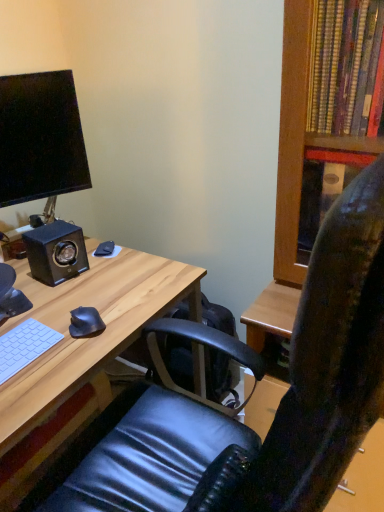
Question: From the image's perspective, is matte black monitor at upper left located above black matte mouse at lower left, which is the first mouse in back-to-front order?

Choices:
 (A) yes
 (B) no

Answer: (A)

Question: Is matte black monitor at upper left to the left of black matte mouse at lower left, the second mouse when ordered from bottom to top, from the viewer's perspective?

Choices:
 (A) yes
 (B) no

Answer: (A)

Question: Does matte black monitor at upper left have a greater height compared to black matte mouse at lower left, which is the first mouse in back-to-front order?

Choices:
 (A) yes
 (B) no

Answer: (A)

Question: Are matte black monitor at upper left and black matte mouse at lower left, the 1th mouse when ordered from top to bottom, beside each other?

Choices:
 (A) yes
 (B) no

Answer: (B)

Question: Can black matte mouse at lower left, which is counted as the 2th mouse, starting from the front, be found inside matte black monitor at upper left?

Choices:
 (A) no
 (B) yes

Answer: (A)

Question: From a real-world perspective, is matte black monitor at upper left physically above black matte mouse at lower left, which is counted as the 2th mouse, starting from the front?

Choices:
 (A) no
 (B) yes

Answer: (B)

Question: Can you confirm if matte black monitor at upper left is shorter than black leather chair at center?

Choices:
 (A) yes
 (B) no

Answer: (A)

Question: Can you confirm if matte black monitor at upper left is wider than black leather chair at center?

Choices:
 (A) yes
 (B) no

Answer: (B)

Question: Is matte black monitor at upper left placed right next to black leather chair at center?

Choices:
 (A) no
 (B) yes

Answer: (A)

Question: From a real-world perspective, is matte black monitor at upper left positioned under black leather chair at center based on gravity?

Choices:
 (A) yes
 (B) no

Answer: (B)

Question: Is matte black monitor at upper left facing away from black leather chair at center?

Choices:
 (A) no
 (B) yes

Answer: (A)

Question: Is matte black monitor at upper left to the right of black leather chair at center from the viewer's perspective?

Choices:
 (A) yes
 (B) no

Answer: (B)

Question: Is light wood desk at center taller than black matte mouse at lower left, the 1th mouse when ordered from top to bottom?

Choices:
 (A) no
 (B) yes

Answer: (B)